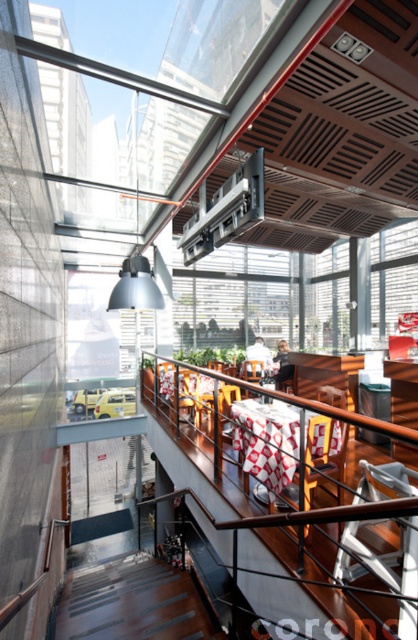
Question: Can you confirm if wooden at upper center is smaller than smooth concrete floor at lower center?

Choices:
 (A) yes
 (B) no

Answer: (B)

Question: Which object appears farthest from the camera in this image?

Choices:
 (A) smooth concrete floor at lower center
 (B) wooden at upper center

Answer: (A)

Question: Can you confirm if wooden at upper center is positioned above dark wood stairs at lower center?

Choices:
 (A) yes
 (B) no

Answer: (A)

Question: Based on their relative distances, which object is farther from the wooden at upper center?

Choices:
 (A) smooth concrete floor at lower center
 (B) dark wood stairs at lower center

Answer: (A)

Question: Does wooden at upper center have a lesser width compared to smooth concrete floor at lower center?

Choices:
 (A) no
 (B) yes

Answer: (A)

Question: Among these points, which one is nearest to the camera?

Choices:
 (A) (129, 525)
 (B) (237, 426)

Answer: (B)